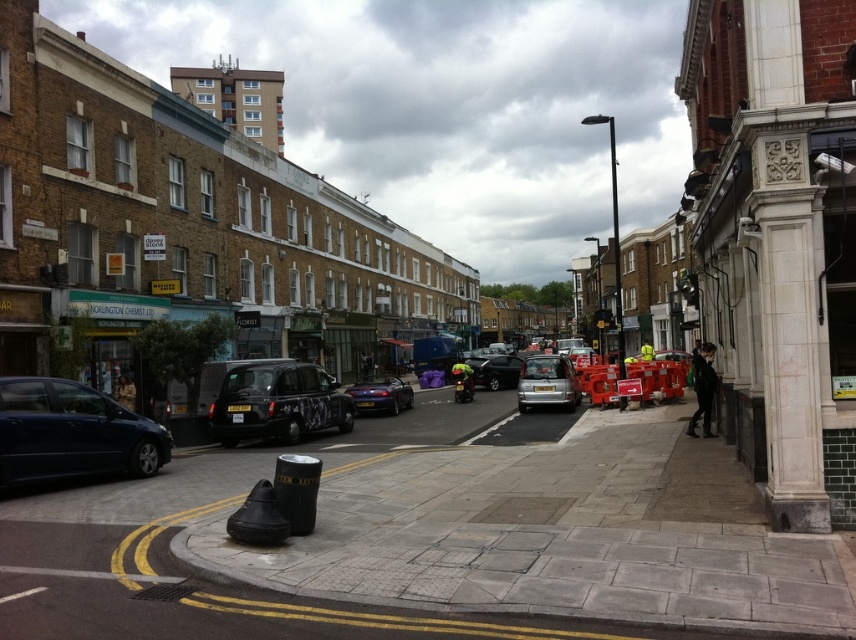
You are a delivery person who needs to load a large package into the trunk of either the black matte taxi at center or the glossy metallic car at center. Considering their heights, which vehicle would allow you to load the package without bending down too much?

The black matte taxi at center has a greater height compared to the glossy metallic car at center, so the black matte taxi at center would allow you to load the package without bending down too much due to its taller trunk height.

You are a pedestrian standing on the sidewalk next to the black matte taxi at center and the silver metallic van at center. You need to cross the street to reach a store located 10 meters ahead. Considering the distance between the two vehicles, can you safely walk between them to cross the road without going further back?

The distance between the black matte taxi at center and the silver metallic van at center is 8.74 meters. Since the store is 10 meters ahead, you would need to walk an additional 1.26 meters beyond the vehicles to reach it. Therefore, you cannot safely cross between them without going further back.